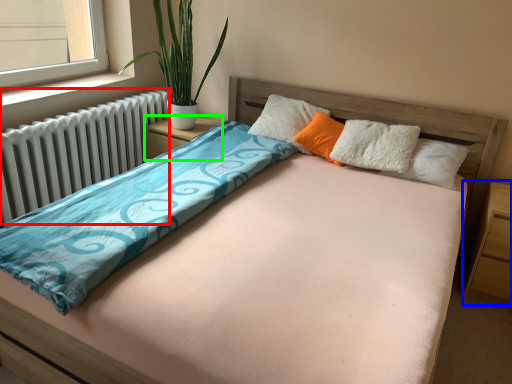
Question: Considering the real-world distances, which object is farthest from radiator (highlighted by a red box)? nightstand (highlighted by a blue box) or nightstand (highlighted by a green box)?

Choices:
 (A) nightstand
 (B) nightstand

Answer: (A)